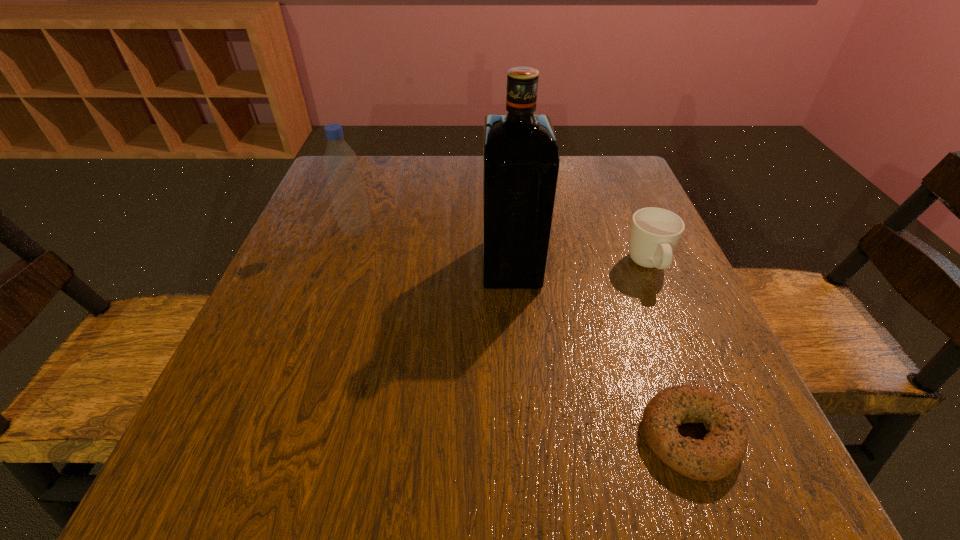
Identify the location of the tallest object. This screenshot has width=960, height=540. (521, 159).

At what (x,y) coordinates should I click in order to perform the action: click on the second object from left to right. Please return your answer as a coordinate pair (x, y). Looking at the image, I should click on (521, 159).

Where is `the farthest object`? the farthest object is located at coordinates (341, 165).

Where is `the third shortest object`? The width and height of the screenshot is (960, 540). the third shortest object is located at coordinates (341, 165).

The height and width of the screenshot is (540, 960). I want to click on cup, so click(x=654, y=233).

In order to click on bagel in this screenshot , I will do `click(721, 451)`.

The width and height of the screenshot is (960, 540). What are the coordinates of `the nearest object` in the screenshot? It's located at (721, 451).

Identify the location of vacant space located 0.150m on the front label of the third object from right to left. The height and width of the screenshot is (540, 960). (407, 265).

At what (x,y) coordinates should I click in order to perform the action: click on vacant space located on the front label of the third object from right to left. Please return your answer as a coordinate pair (x, y). This screenshot has width=960, height=540. Looking at the image, I should click on (427, 265).

This screenshot has width=960, height=540. What are the coordinates of `vacant point located on the front label of the third object from right to left` in the screenshot? It's located at [x=362, y=265].